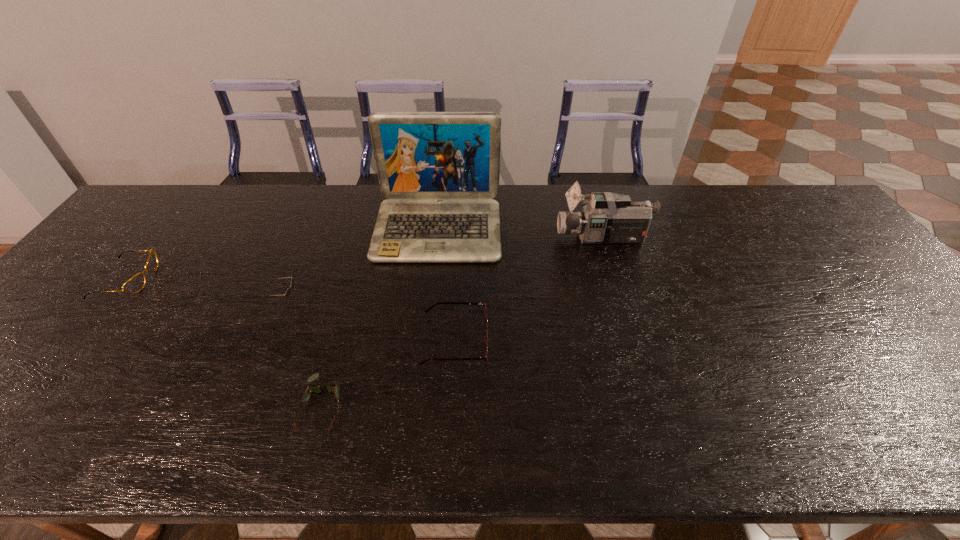
At what (x,y) coordinates should I click in order to perform the action: click on vacant space that satisfies the following two spatial constraints: 1. on the screen of the tallest object; 2. on the front-facing side of the leftmost object. Please return your answer as a coordinate pair (x, y). This screenshot has height=540, width=960. Looking at the image, I should click on (433, 279).

Locate an element on the screen. free space that satisfies the following two spatial constraints: 1. on the lenses of the second farthest spectacles; 2. on the front-facing side of the shortest spectacles is located at coordinates (452, 404).